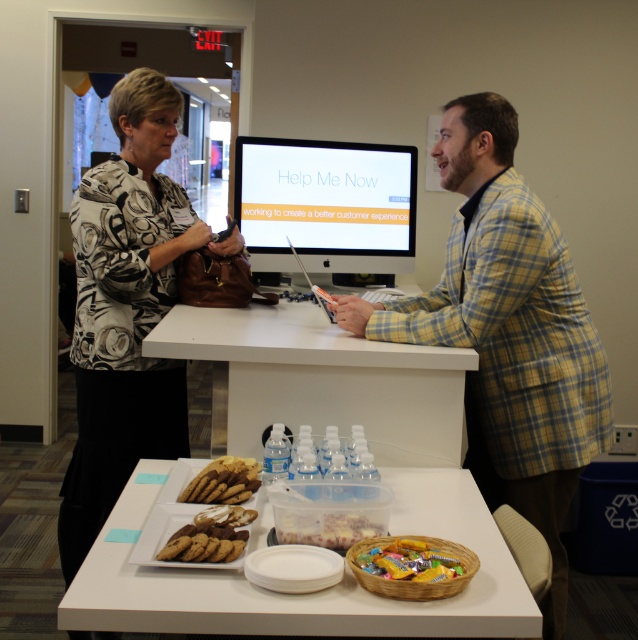
Can you confirm if matte silver monitor at center is wider than shiny plastic basket of candy at lower center?

Yes, matte silver monitor at center is wider than shiny plastic basket of candy at lower center.

Can you confirm if matte silver monitor at center is thinner than shiny plastic basket of candy at lower center?

Incorrect, matte silver monitor at center's width is not less than shiny plastic basket of candy at lower center's.

Is point (353, 198) positioned after point (389, 568)?

That is True.

The height and width of the screenshot is (640, 638). I want to click on matte silver monitor at center, so click(x=327, y=204).

Is yellow plaid blazer at center positioned before white plastic table at lower center?

No, it is not.

Can you confirm if yellow plaid blazer at center is positioned to the right of white plastic table at lower center?

Yes, yellow plaid blazer at center is to the right of white plastic table at lower center.

Where is `yellow plaid blazer at center`? Image resolution: width=638 pixels, height=640 pixels. yellow plaid blazer at center is located at coordinates (507, 332).

Which is above, black printed blouse at center or smooth plastic container at center?

black printed blouse at center is above.

Does black printed blouse at center appear over smooth plastic container at center?

Yes.

The image size is (638, 640). What do you see at coordinates (126, 308) in the screenshot?
I see `black printed blouse at center` at bounding box center [126, 308].

This screenshot has height=640, width=638. What are the coordinates of `black printed blouse at center` in the screenshot? It's located at (126, 308).